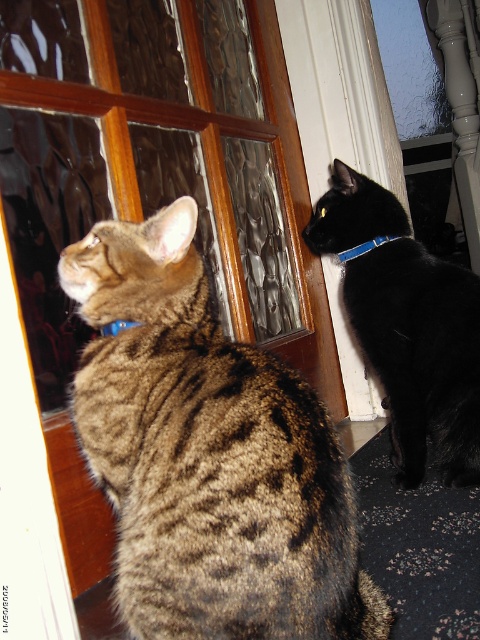
Question: Does brown textured fur cat at left have a smaller size compared to matte plastic neckband at upper left?

Choices:
 (A) yes
 (B) no

Answer: (B)

Question: Considering the relative positions of black smooth fur cat at upper right and blue fabric neckband at upper right in the image provided, where is black smooth fur cat at upper right located with respect to blue fabric neckband at upper right?

Choices:
 (A) right
 (B) left

Answer: (A)

Question: Which of the following is the farthest from the observer?

Choices:
 (A) (156, 276)
 (B) (367, 244)
 (C) (414, 397)
 (D) (107, 333)

Answer: (B)

Question: Considering the real-world distances, which object is closest to the brown textured fur cat at left?

Choices:
 (A) matte plastic neckband at upper left
 (B) black smooth fur cat at upper right
 (C) blue fabric neckband at upper right

Answer: (A)

Question: Based on their relative distances, which object is farther from the brown textured fur cat at left?

Choices:
 (A) matte plastic neckband at upper left
 (B) black smooth fur cat at upper right

Answer: (B)

Question: Is black smooth fur cat at upper right smaller than matte plastic neckband at upper left?

Choices:
 (A) yes
 (B) no

Answer: (B)